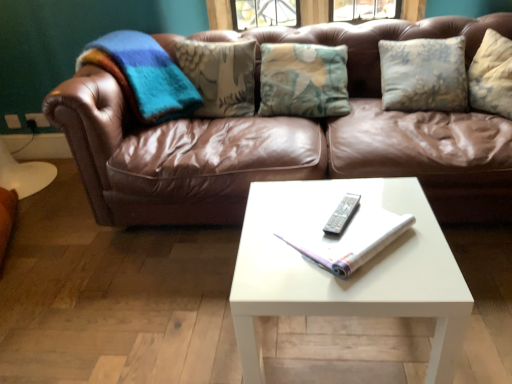
Question: Would you say brown leather couch at center is outside white glossy coffee table at center?

Choices:
 (A) yes
 (B) no

Answer: (A)

Question: Considering the relative sizes of brown leather couch at center and white glossy coffee table at center in the image provided, is brown leather couch at center bigger than white glossy coffee table at center?

Choices:
 (A) yes
 (B) no

Answer: (A)

Question: From the image's perspective, is brown leather couch at center above white glossy coffee table at center?

Choices:
 (A) no
 (B) yes

Answer: (B)

Question: Does brown leather couch at center appear on the right side of white glossy coffee table at center?

Choices:
 (A) yes
 (B) no

Answer: (A)

Question: Is brown leather couch at center facing towards white glossy coffee table at center?

Choices:
 (A) yes
 (B) no

Answer: (A)

Question: Does brown leather couch at center come in front of white glossy coffee table at center?

Choices:
 (A) no
 (B) yes

Answer: (A)

Question: Could you tell me if silver metallic remote at center is facing white paper book at center?

Choices:
 (A) yes
 (B) no

Answer: (A)

Question: From the image's perspective, is silver metallic remote at center over white paper book at center?

Choices:
 (A) no
 (B) yes

Answer: (B)

Question: Is silver metallic remote at center far away from white paper book at center?

Choices:
 (A) no
 (B) yes

Answer: (A)

Question: Is the surface of silver metallic remote at center in direct contact with white paper book at center?

Choices:
 (A) no
 (B) yes

Answer: (B)

Question: Does silver metallic remote at center appear on the right side of white paper book at center?

Choices:
 (A) yes
 (B) no

Answer: (A)

Question: From a real-world perspective, is silver metallic remote at center over white paper book at center?

Choices:
 (A) no
 (B) yes

Answer: (A)

Question: Considering the relative positions of white paper book at center and brown leather couch at center in the image provided, is white paper book at center to the left of brown leather couch at center from the viewer's perspective?

Choices:
 (A) no
 (B) yes

Answer: (B)